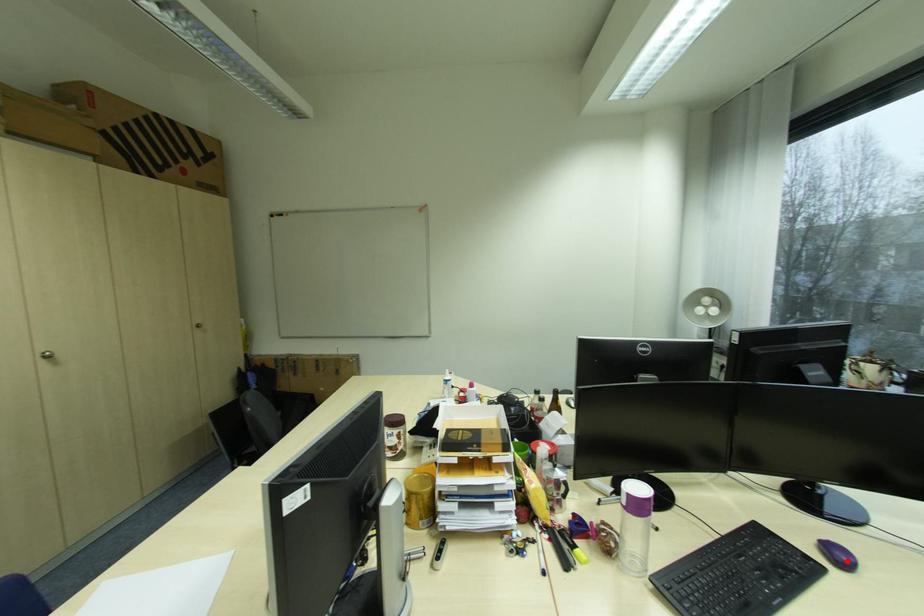
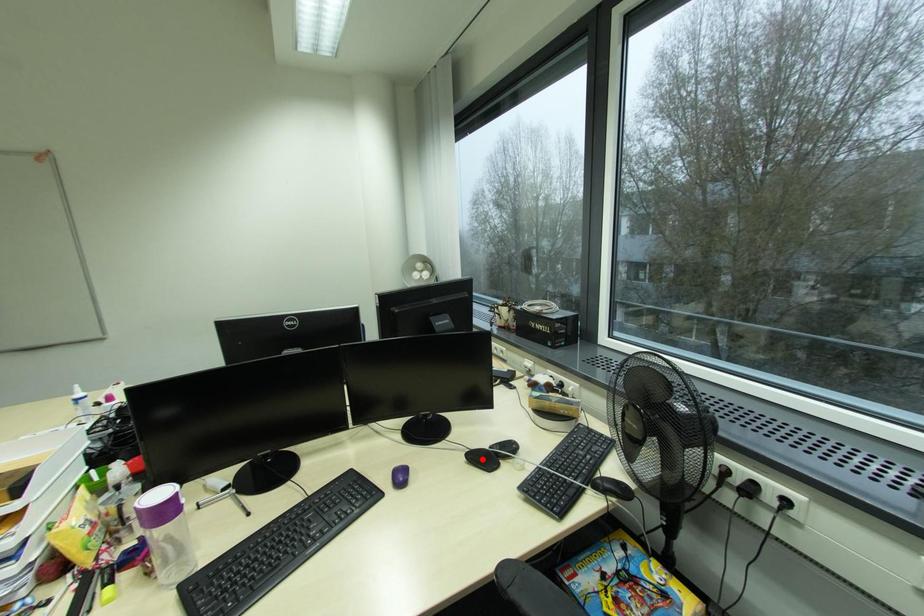
I am providing you with two images of the same scene from different viewpoints. A red point is marked on the first image and another point is marked on the second image. Does the point marked in image1 correspond to the same location as the one in image2?

No